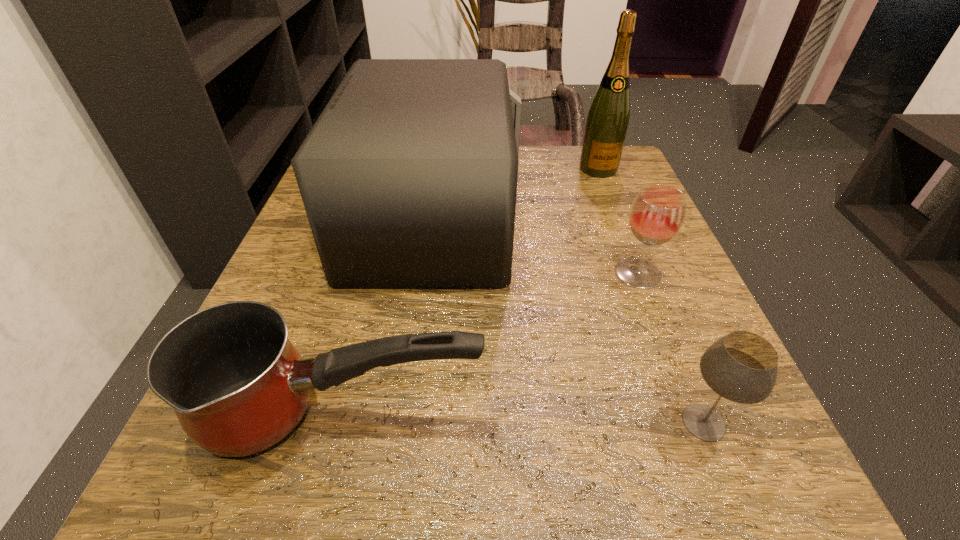
Image resolution: width=960 pixels, height=540 pixels. In order to click on vacant area that satisfies the following two spatial constraints: 1. on the front-facing side of the tallest object; 2. on the front-facing side of the microwave oven in this screenshot , I will do `click(617, 218)`.

Where is `vacant point that satisfies the following two spatial constraints: 1. on the front-facing side of the microwave oven; 2. on the back side of the nearer wineglass`? vacant point that satisfies the following two spatial constraints: 1. on the front-facing side of the microwave oven; 2. on the back side of the nearer wineglass is located at coordinates (407, 422).

Where is `free region that satisfies the following two spatial constraints: 1. on the back side of the farther wineglass; 2. on the front-facing side of the fourth shortest object`? This screenshot has width=960, height=540. free region that satisfies the following two spatial constraints: 1. on the back side of the farther wineglass; 2. on the front-facing side of the fourth shortest object is located at coordinates (616, 218).

The width and height of the screenshot is (960, 540). I want to click on free space that satisfies the following two spatial constraints: 1. on the handle side of the saucepan; 2. on the right side of the nearer wineglass, so click(342, 422).